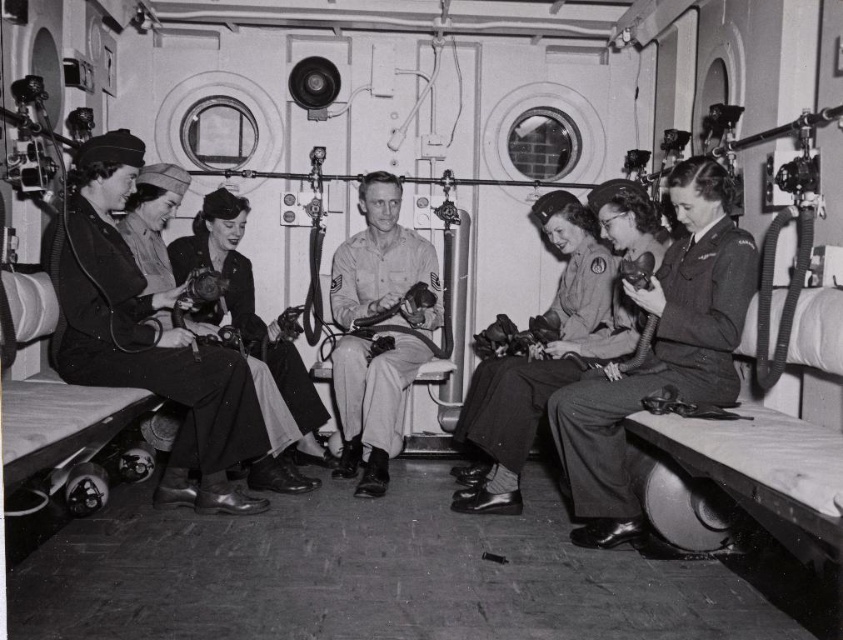
Question: Is smooth khaki uniform at center wider than khaki cotton shirt at center?

Choices:
 (A) yes
 (B) no

Answer: (B)

Question: Among these objects, which one is farthest from the camera?

Choices:
 (A) smooth khaki uniform at center
 (B) khaki cotton shirt at center
 (C) khaki uniform at center

Answer: (C)

Question: Is smooth leather shoes at left smaller than smooth khaki uniform at center?

Choices:
 (A) no
 (B) yes

Answer: (A)

Question: Which point is farther to the camera?

Choices:
 (A) (575, 280)
 (B) (129, 316)
 (C) (422, 244)
 (D) (711, 381)

Answer: (C)

Question: Which point is closer to the camera?

Choices:
 (A) smooth leather shoes at left
 (B) smooth khaki uniform at center
 (C) matte black uniform at center
 (D) khaki cotton shirt at center

Answer: (B)

Question: Is khaki cotton shirt at center positioned in front of matte black uniform at center?

Choices:
 (A) yes
 (B) no

Answer: (A)